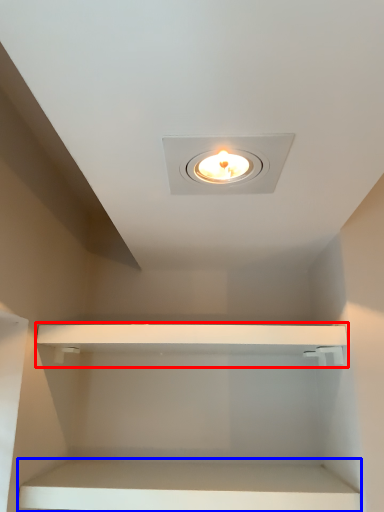
Question: Which object is further to the camera taking this photo, cabinet (highlighted by a red box) or cabinet (highlighted by a blue box)?

Choices:
 (A) cabinet
 (B) cabinet

Answer: (A)